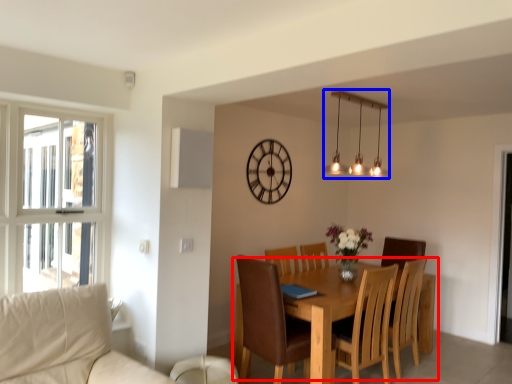
Question: Which of the following is the closest to the observer, kitchen & dining room table (highlighted by a red box) or lamp (highlighted by a blue box)?

Choices:
 (A) kitchen & dining room table
 (B) lamp

Answer: (A)